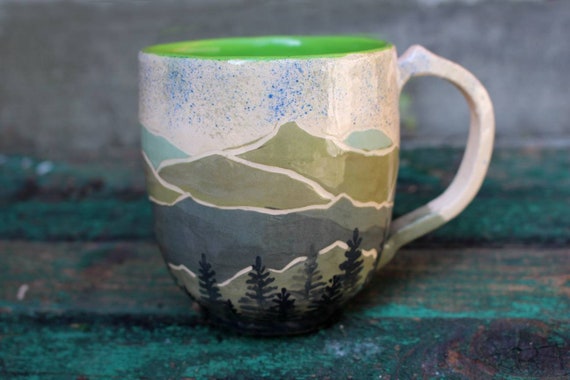
Locate an element on the screen. The width and height of the screenshot is (570, 380). handle is located at coordinates (484, 132).